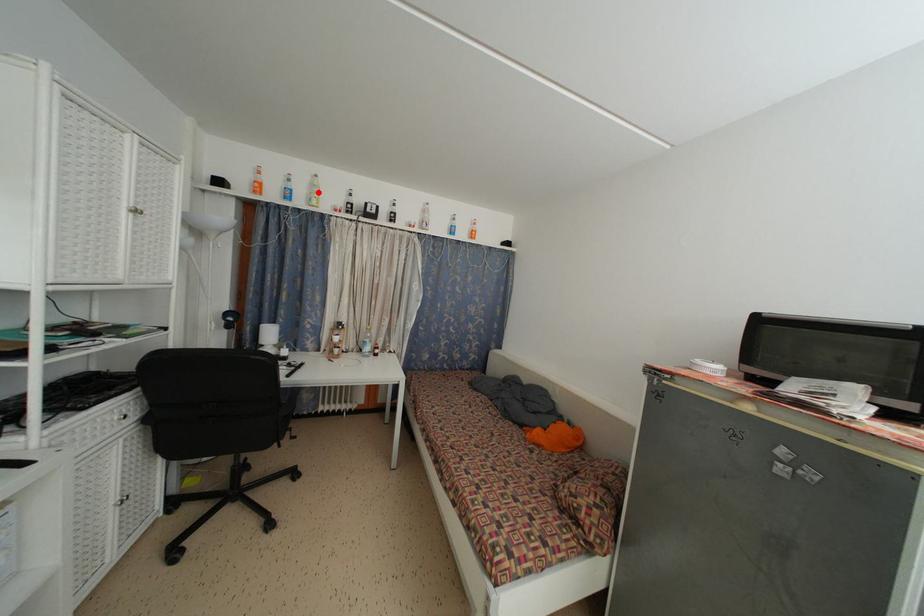
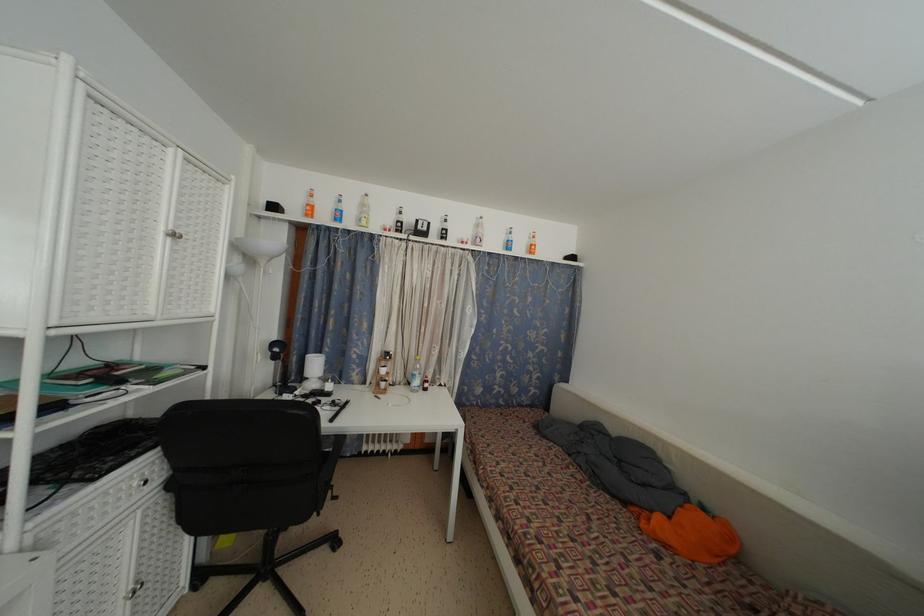
Question: I am providing you with two images of the same scene from different viewpoints. A red point is marked on the first image. Is the red point's position out of view in image 2?

Choices:
 (A) Yes
 (B) No

Answer: (B)